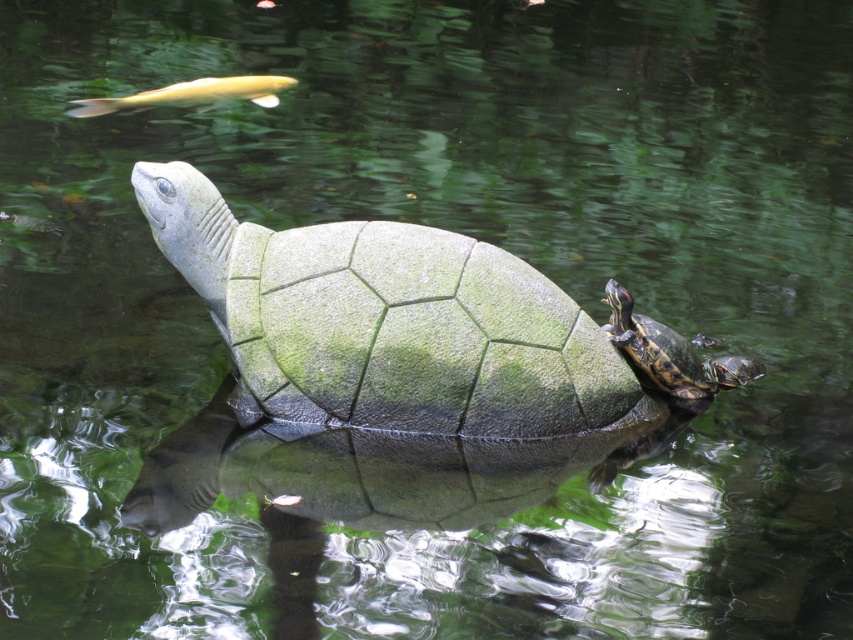
What are the coordinates of the shiny brown tortoise at upper right in the image?

The shiny brown tortoise at upper right is located at coordinates point [670,355].

You are a photographer trying to capture the green mossy tortoise at center and the golden smooth fish at upper left in the same frame. Can you see both objects clearly at the same time?

Yes, the green mossy tortoise at center is in front of the golden smooth fish at upper left, so both can be seen in the same frame.